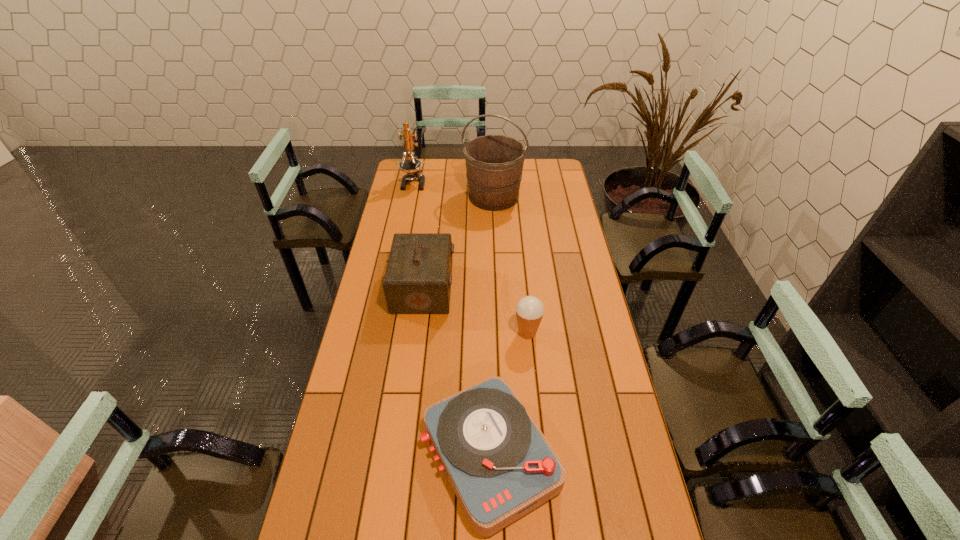
Where is `free space that satisfies the following two spatial constraints: 1. at the eyepiece of the microscope; 2. on the left side of the first-aid kit`? free space that satisfies the following two spatial constraints: 1. at the eyepiece of the microscope; 2. on the left side of the first-aid kit is located at coordinates (393, 288).

Locate an element on the screen. Image resolution: width=960 pixels, height=540 pixels. free space that satisfies the following two spatial constraints: 1. at the eyepiece of the nearest object; 2. on the left side of the fourth shortest object is located at coordinates (359, 456).

Find the location of a particular element. This screenshot has width=960, height=540. free spot that satisfies the following two spatial constraints: 1. on the back side of the record player; 2. on the right side of the icecream is located at coordinates (487, 333).